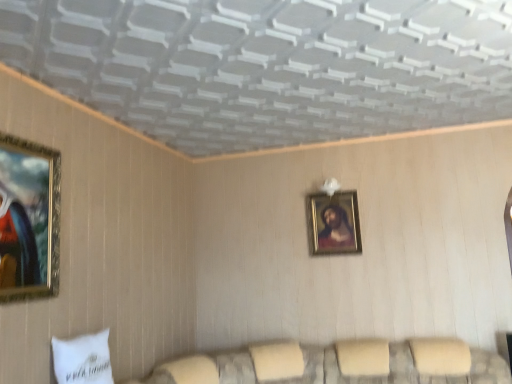
Question: Does gold-framed portrait at center, which ranks as the second picture frame in left-to-right order, appear on the right side of white fabric pillow at lower left?

Choices:
 (A) no
 (B) yes

Answer: (B)

Question: From the image's perspective, would you say gold-framed portrait at center, the first picture frame when ordered from right to left, is positioned over white fabric pillow at lower left?

Choices:
 (A) no
 (B) yes

Answer: (B)

Question: Does gold-framed portrait at center, which ranks as the second picture frame in left-to-right order, lie behind white fabric pillow at lower left?

Choices:
 (A) no
 (B) yes

Answer: (B)

Question: Is white fabric pillow at lower left at the back of gold-framed portrait at center, the first picture frame when ordered from right to left?

Choices:
 (A) yes
 (B) no

Answer: (B)

Question: From a real-world perspective, is gold-framed portrait at center, the first picture frame in the back-to-front sequence, physically above white fabric pillow at lower left?

Choices:
 (A) yes
 (B) no

Answer: (A)

Question: In terms of height, does gold-framed portrait at center, which ranks as the second picture frame in left-to-right order, look taller or shorter compared to white fabric pillow at lower left?

Choices:
 (A) short
 (B) tall

Answer: (B)

Question: Is gold-framed portrait at center, which ranks as the second picture frame in left-to-right order, to the left or to the right of white fabric pillow at lower left in the image?

Choices:
 (A) left
 (B) right

Answer: (B)

Question: From the image's perspective, is gold-framed portrait at center, which ranks as the second picture frame in left-to-right order, located above or below white fabric pillow at lower left?

Choices:
 (A) below
 (B) above

Answer: (B)

Question: From a real-world perspective, is gold-framed portrait at center, which ranks as the second picture frame in left-to-right order, physically located above or below white fabric pillow at lower left?

Choices:
 (A) above
 (B) below

Answer: (A)

Question: Is gold-framed painting at left, the 2th picture frame positioned from the back, bigger or smaller than gold-framed portrait at center, the first picture frame when ordered from right to left?

Choices:
 (A) big
 (B) small

Answer: (A)

Question: From the image's perspective, is gold-framed painting at left, arranged as the 1th picture frame when viewed from the front, above or below gold-framed portrait at center, the first picture frame when ordered from right to left?

Choices:
 (A) above
 (B) below

Answer: (A)

Question: Based on their positions, is gold-framed painting at left, which appears as the 2th picture frame when viewed from the right, located to the left or right of gold-framed portrait at center, marked as the 2th picture frame in a front-to-back arrangement?

Choices:
 (A) right
 (B) left

Answer: (B)

Question: Would you say gold-framed painting at left, the 1th picture frame when ordered from left to right, is inside or outside gold-framed portrait at center, marked as the 2th picture frame in a front-to-back arrangement?

Choices:
 (A) inside
 (B) outside

Answer: (B)

Question: Is gold-framed portrait at center, which ranks as the second picture frame in left-to-right order, wider or thinner than velvet beige couch at lower center?

Choices:
 (A) thin
 (B) wide

Answer: (A)

Question: Is gold-framed portrait at center, the first picture frame when ordered from right to left, bigger or smaller than velvet beige couch at lower center?

Choices:
 (A) big
 (B) small

Answer: (B)